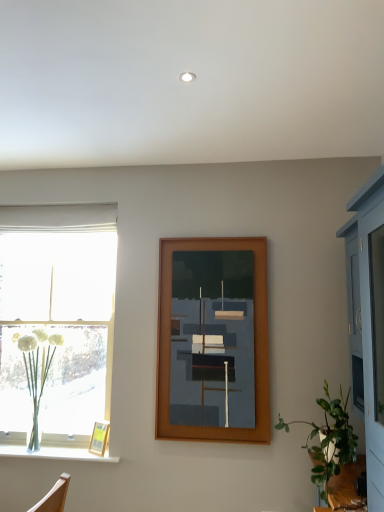
Question: Is clear glass vase at lower left oriented towards wooden picture frame at lower left, positioned as the first picture frame in bottom-to-top order?

Choices:
 (A) yes
 (B) no

Answer: (B)

Question: Is clear glass vase at lower left behind wooden picture frame at lower left, which is the second picture frame from top to bottom?

Choices:
 (A) yes
 (B) no

Answer: (B)

Question: Can you confirm if clear glass vase at lower left is thinner than wooden picture frame at lower left, which ranks as the second picture frame in right-to-left order?

Choices:
 (A) yes
 (B) no

Answer: (B)

Question: Considering the relative sizes of clear glass vase at lower left and wooden picture frame at lower left, which is the second picture frame from top to bottom, in the image provided, is clear glass vase at lower left wider than wooden picture frame at lower left, which is the second picture frame from top to bottom,?

Choices:
 (A) no
 (B) yes

Answer: (B)

Question: Does clear glass vase at lower left come in front of wooden picture frame at lower left, which is the second picture frame from top to bottom?

Choices:
 (A) no
 (B) yes

Answer: (B)

Question: Is wooden picture frame at lower left, positioned as the first picture frame in bottom-to-top order, surrounded by clear glass vase at lower left?

Choices:
 (A) no
 (B) yes

Answer: (A)

Question: Would you say wooden picture frame at center, which appears as the 2th picture frame when viewed from the left, is outside green leafy plant at lower right?

Choices:
 (A) yes
 (B) no

Answer: (A)

Question: Is wooden picture frame at center, which appears as the first picture frame when viewed from the right, facing away from green leafy plant at lower right?

Choices:
 (A) no
 (B) yes

Answer: (A)

Question: Does wooden picture frame at center, which appears as the first picture frame when viewed from the right, have a lesser height compared to green leafy plant at lower right?

Choices:
 (A) yes
 (B) no

Answer: (B)

Question: Is the surface of wooden picture frame at center, placed as the 1th picture frame when sorted from top to bottom, in direct contact with green leafy plant at lower right?

Choices:
 (A) no
 (B) yes

Answer: (A)

Question: From the image's perspective, does wooden picture frame at center, the second picture frame in the bottom-to-top sequence, appear higher than green leafy plant at lower right?

Choices:
 (A) yes
 (B) no

Answer: (A)

Question: From the image's perspective, is wooden picture frame at center, placed as the 1th picture frame when sorted from top to bottom, beneath green leafy plant at lower right?

Choices:
 (A) no
 (B) yes

Answer: (A)

Question: Is wooden picture frame at center, the second picture frame in the bottom-to-top sequence, taller than wooden picture frame at lower left, which is the second picture frame from top to bottom?

Choices:
 (A) no
 (B) yes

Answer: (B)